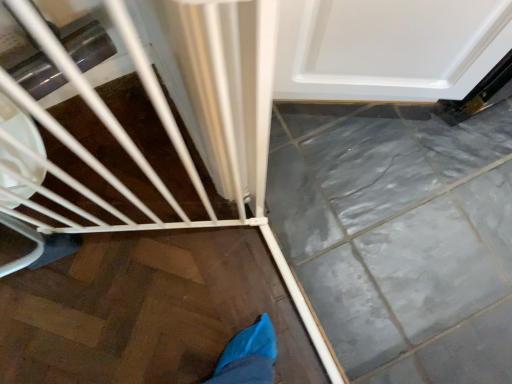
Question: Is white glossy door at upper right not near white matte baby carriage at lower left?

Choices:
 (A) no
 (B) yes

Answer: (A)

Question: Does white glossy door at upper right have a larger size compared to white matte baby carriage at lower left?

Choices:
 (A) no
 (B) yes

Answer: (B)

Question: Is white glossy door at upper right next to white matte baby carriage at lower left and touching it?

Choices:
 (A) no
 (B) yes

Answer: (A)

Question: From the image's perspective, is white glossy door at upper right over white matte baby carriage at lower left?

Choices:
 (A) yes
 (B) no

Answer: (A)

Question: Is white glossy door at upper right closer to camera compared to white matte baby carriage at lower left?

Choices:
 (A) no
 (B) yes

Answer: (A)

Question: Is white matte baby carriage at lower left inside white glossy door at upper right?

Choices:
 (A) no
 (B) yes

Answer: (A)

Question: Can you confirm if white matte baby carriage at lower left is taller than white glossy door at upper right?

Choices:
 (A) yes
 (B) no

Answer: (A)

Question: Is white matte baby carriage at lower left next to white glossy door at upper right and touching it?

Choices:
 (A) no
 (B) yes

Answer: (A)

Question: Does white matte baby carriage at lower left have a larger size compared to white glossy door at upper right?

Choices:
 (A) no
 (B) yes

Answer: (A)

Question: Considering the relative positions of white matte baby carriage at lower left and white glossy door at upper right in the image provided, is white matte baby carriage at lower left to the left of white glossy door at upper right from the viewer's perspective?

Choices:
 (A) no
 (B) yes

Answer: (B)

Question: From the image's perspective, is white matte baby carriage at lower left below white glossy door at upper right?

Choices:
 (A) no
 (B) yes

Answer: (B)

Question: Does white matte baby carriage at lower left have a lesser height compared to white glossy door at upper right?

Choices:
 (A) yes
 (B) no

Answer: (B)

Question: Would you say white glossy door at upper right is to the left or to the right of white matte baby carriage at lower left in the picture?

Choices:
 (A) left
 (B) right

Answer: (B)